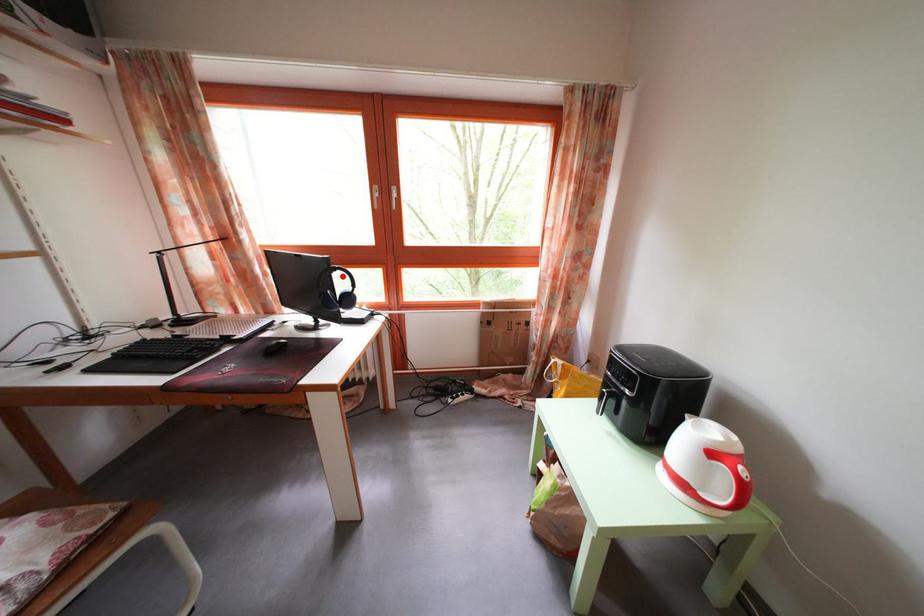
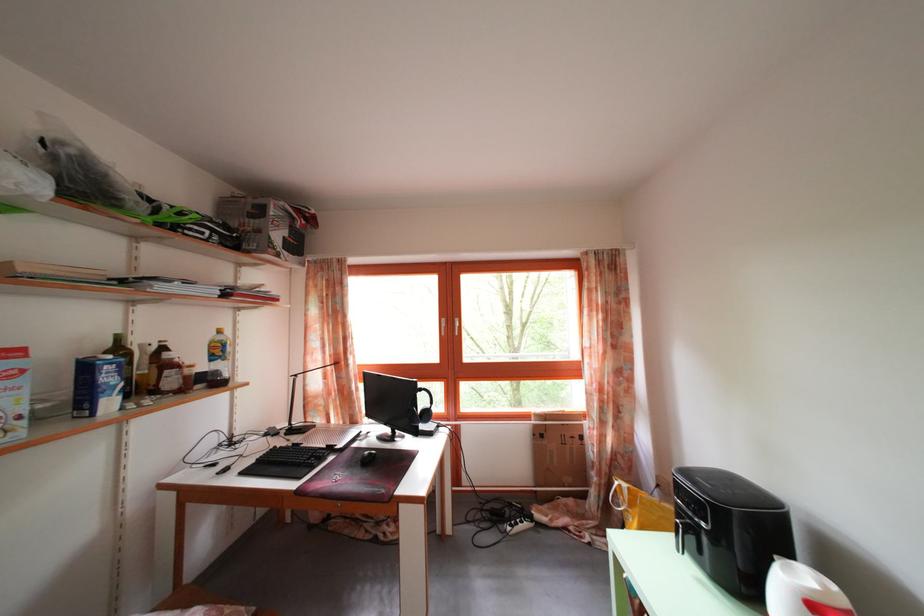
Where in the second image is the point corresponding to the highlighted location from the first image?

(428, 397)